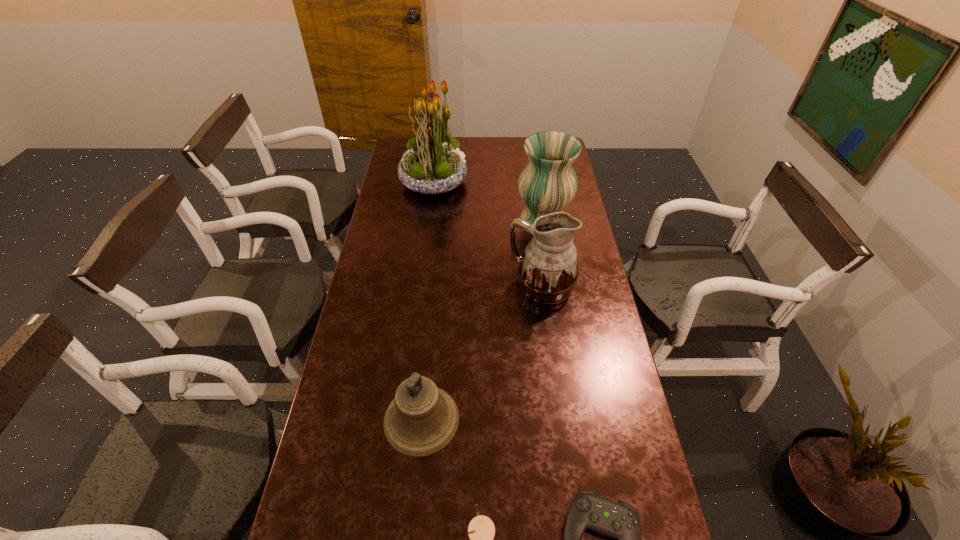
Locate an element on the screen. The image size is (960, 540). flower arrangement is located at coordinates (433, 164).

Locate an element on the screen. vase is located at coordinates (548, 183).

I want to click on pitcher, so click(x=548, y=270).

Find the location of a particular element. This screenshot has width=960, height=540. the fourth tallest object is located at coordinates (422, 419).

You are a GUI agent. You are given a task and a screenshot of the screen. Output one action in this format:
    pyautogui.click(x=<x>, y=<y>)
    Task: Click on the bell
    The image size is (960, 540).
    Given the screenshot: What is the action you would take?
    point(422,419)

Find the location of `free space located 0.320m on the front-facing side of the flower arrangement`. free space located 0.320m on the front-facing side of the flower arrangement is located at coordinates (538, 181).

Locate an element on the screen. This screenshot has width=960, height=540. vacant space located 0.180m on the front of the vase is located at coordinates (551, 270).

You are a GUI agent. You are given a task and a screenshot of the screen. Output one action in this format:
    pyautogui.click(x=<x>, y=<y>)
    Task: Click on the vacant area situated from the spout of the fourth nearest object
    
    Given the screenshot: What is the action you would take?
    pyautogui.click(x=477, y=286)

At what (x,y) coordinates should I click in order to perform the action: click on blank space located 0.320m from the spout of the fourth nearest object. Please return your answer as a coordinate pair (x, y). Image resolution: width=960 pixels, height=540 pixels. Looking at the image, I should click on (419, 286).

Find the location of a particular element. Image resolution: width=960 pixels, height=540 pixels. vacant region located 0.060m from the spout of the fourth nearest object is located at coordinates (492, 286).